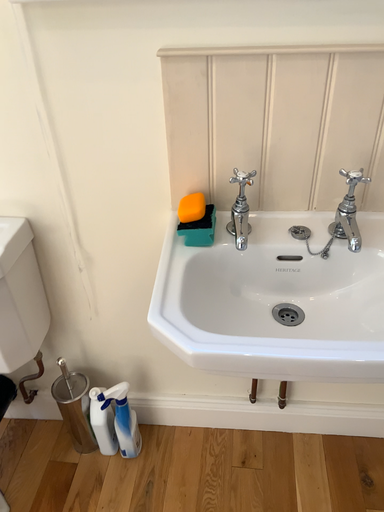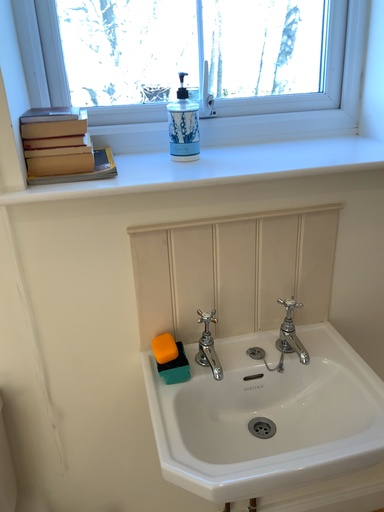
Question: How did the camera likely rotate when shooting the video?

Choices:
 (A) rotated upward
 (B) rotated downward

Answer: (A)